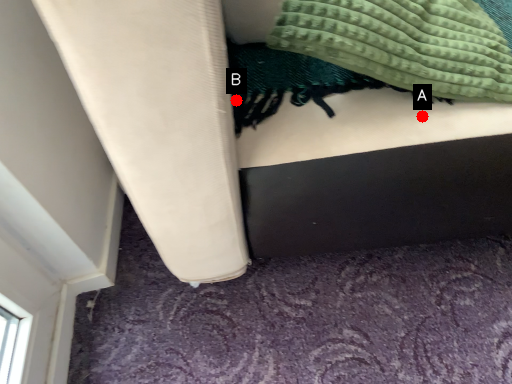
Question: Two points are circled on the image, labeled by A and B beside each circle. Among these points, which one is nearest to the camera?

Choices:
 (A) A is closer
 (B) B is closer

Answer: (A)